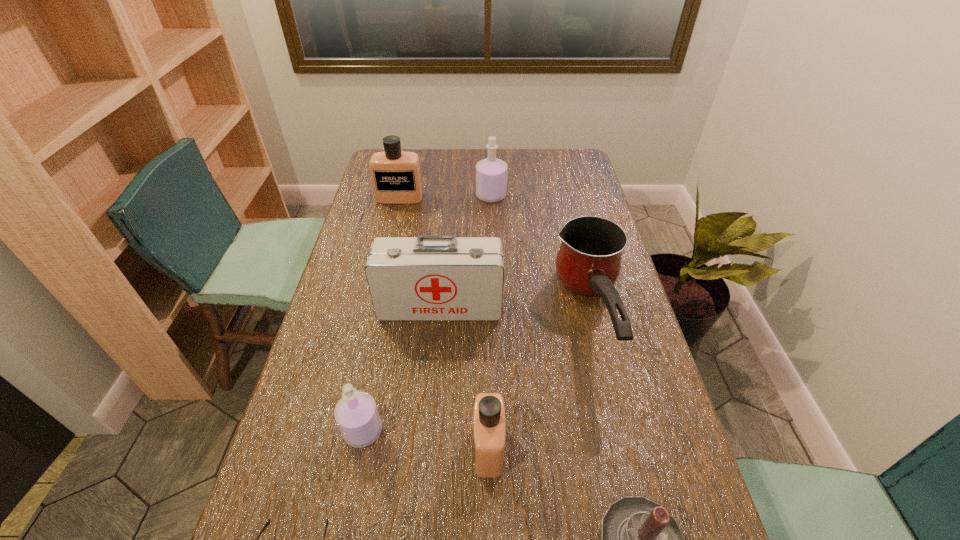
You are a GUI agent. You are given a task and a screenshot of the screen. Output one action in this format:
    pyautogui.click(x=<x>, y=<y>)
    Task: Click on the vacant space at the far edge of the desktop
    The width and height of the screenshot is (960, 540).
    Given the screenshot: What is the action you would take?
    pyautogui.click(x=540, y=158)

At what (x,y) coordinates should I click in order to perform the action: click on vacant space at the left edge of the desktop. Please return your answer as a coordinate pair (x, y). The image size is (960, 540). Looking at the image, I should click on (365, 215).

The image size is (960, 540). In the image, there is a desktop. In order to click on free space at the right edge in this screenshot , I will do `click(596, 298)`.

The width and height of the screenshot is (960, 540). I want to click on blank space at the far right corner of the desktop, so click(x=552, y=168).

Where is `free space between the smaller purple perfume and the saucepan`? The width and height of the screenshot is (960, 540). free space between the smaller purple perfume and the saucepan is located at coordinates (477, 373).

This screenshot has height=540, width=960. I want to click on free space between the bigger beige perfume and the farther purple perfume, so click(x=445, y=197).

The width and height of the screenshot is (960, 540). I want to click on blank region between the nearer purple perfume and the saucepan, so click(477, 373).

Where is `blank region between the saucepan and the nearer beige perfume`? blank region between the saucepan and the nearer beige perfume is located at coordinates (540, 381).

Identify which object is the third nearest to the right purple perfume. Please provide its 2D coordinates. Your answer should be formatted as a tuple, i.e. [(x, y)], where the tuple contains the x and y coordinates of a point satisfying the conditions above.

[(427, 278)]

This screenshot has width=960, height=540. Find the location of `object that is the third closest one to the right purple perfume`. object that is the third closest one to the right purple perfume is located at coordinates (427, 278).